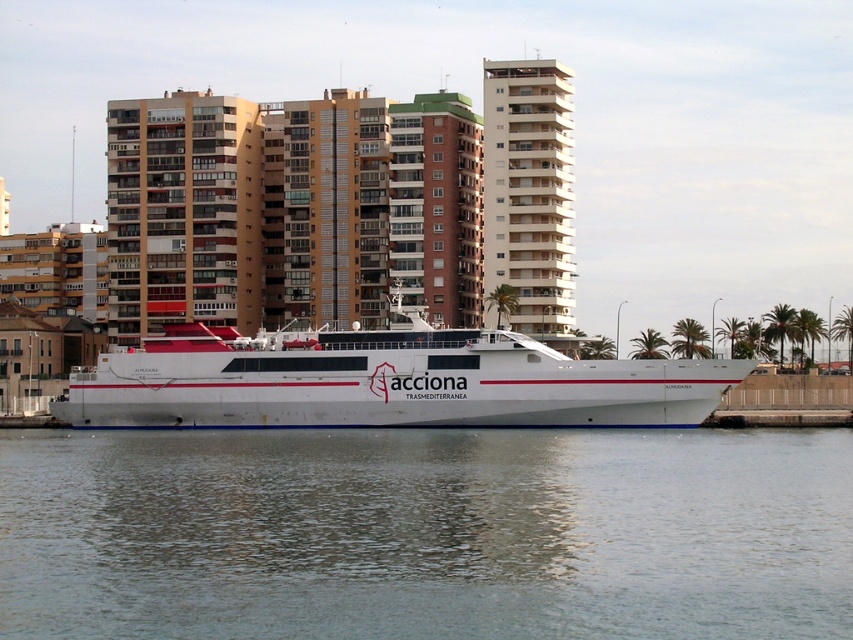
Question: Is clear water at lower center to the right of white matte ship at center from the viewer's perspective?

Choices:
 (A) no
 (B) yes

Answer: (B)

Question: Does clear water at lower center appear on the left side of white matte ship at center?

Choices:
 (A) no
 (B) yes

Answer: (A)

Question: Which object is farther from the camera taking this photo?

Choices:
 (A) white matte ship at center
 (B) clear water at lower center

Answer: (A)

Question: Does clear water at lower center have a greater width compared to white matte ship at center?

Choices:
 (A) yes
 (B) no

Answer: (A)

Question: Which of the following is the closest to the observer?

Choices:
 (A) (518, 451)
 (B) (607, 369)

Answer: (A)